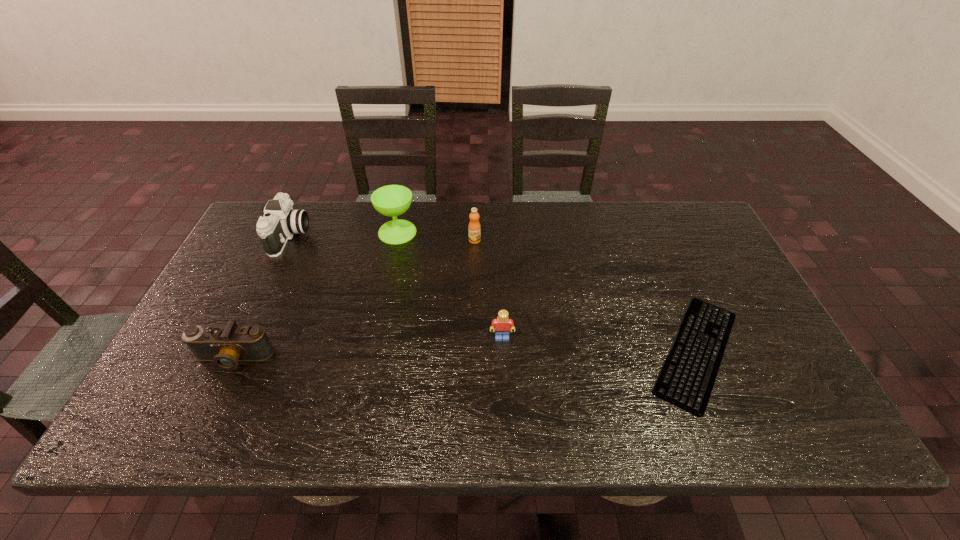
The height and width of the screenshot is (540, 960). Identify the location of free space between the computer keyboard and the orange juice. (586, 296).

Where is `free space between the farther camera and the shorter camera`? free space between the farther camera and the shorter camera is located at coordinates (262, 297).

Find the location of `vacant point located between the shorter camera and the wineglass`. vacant point located between the shorter camera and the wineglass is located at coordinates (316, 295).

Where is `empty location between the Lego and the taller camera`? This screenshot has height=540, width=960. empty location between the Lego and the taller camera is located at coordinates (396, 287).

In order to click on free space between the fourth object from right to left and the fourth object from left to right in this screenshot , I will do `click(436, 236)`.

Locate an element on the screen. This screenshot has height=540, width=960. vacant area between the computer keyboard and the shorter camera is located at coordinates (465, 355).

The image size is (960, 540). Identify the location of object that stands as the third closest to the taller camera. (474, 228).

Where is `object that stands as the fourth closest to the shortest object`? The height and width of the screenshot is (540, 960). object that stands as the fourth closest to the shortest object is located at coordinates click(225, 345).

The width and height of the screenshot is (960, 540). Identify the location of vacant position in the image that satisfies the following two spatial constraints: 1. on the front side of the wineglass; 2. on the right side of the rightmost object. coord(372,352).